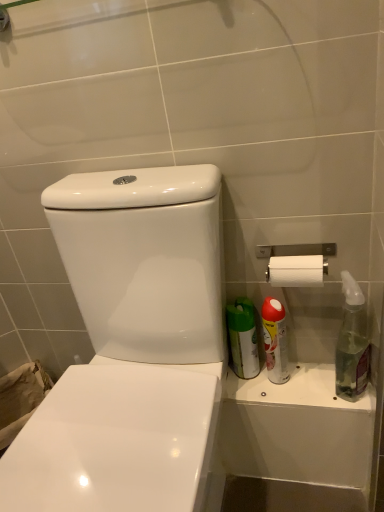
At what (x,y) coordinates should I click in order to perform the action: click on vacant position to the left of clear glass spray bottle at right, positioned as the 1th cleaning product in right-to-left order. Please return your answer as a coordinate pair (x, y). Image resolution: width=384 pixels, height=512 pixels. Looking at the image, I should click on (309, 393).